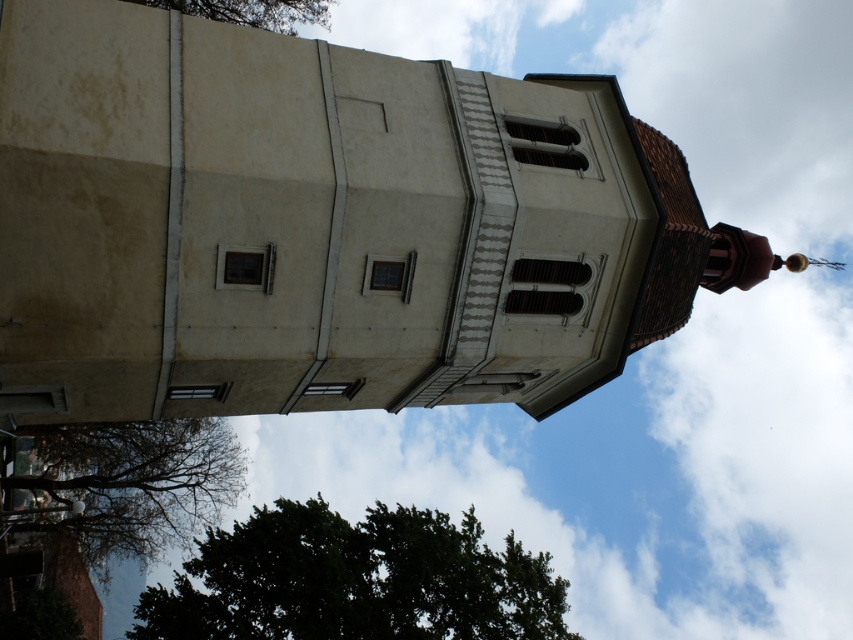
You are standing at the center of the image and want to locate the dark green leafy tree at lower left. In which direction should you look to find it?

The dark green leafy tree at lower left is located at point (357, 580), so you should look towards the lower left direction to find it.

You are standing at the base of the dark green leafy tree at lower left and want to walk to the entrance of the cylindrical building. The path is straight and clear. If you walk at a constant speed of 1.5 meters per second, how many seconds will it take you to reach the entrance?

The distance between the dark green leafy tree at lower left and the viewer is 46.82 meters. Since you are at the tree, the entrance is 46.82 meters away. At 1.5 meters per second, it would take 46.82 divided by 1.5, which is approximately 31.21 seconds.